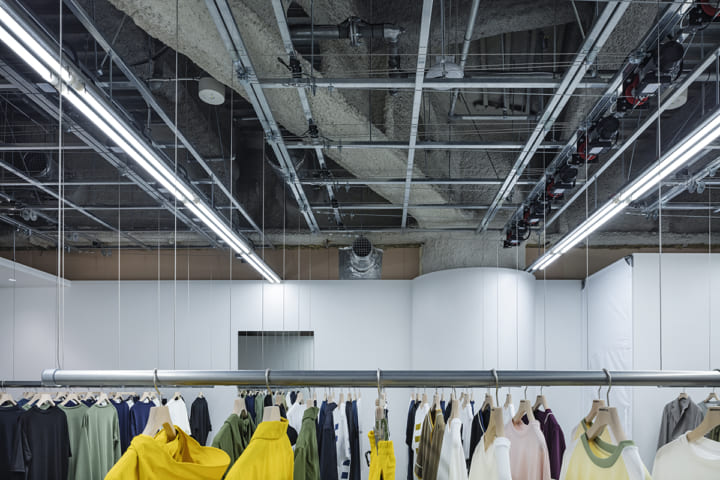
Locate an element on the screen. The image size is (720, 480). wall is located at coordinates (499, 318).